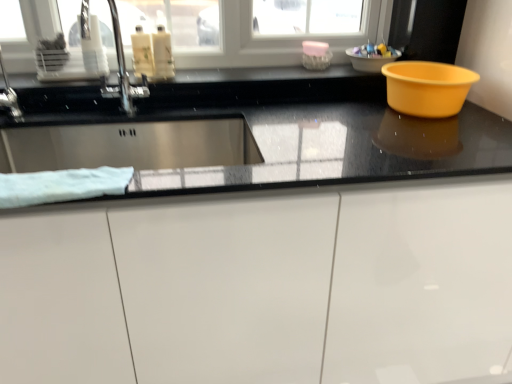
What do you see at coordinates (62, 185) in the screenshot?
I see `white soft towel at left` at bounding box center [62, 185].

The width and height of the screenshot is (512, 384). Describe the element at coordinates (426, 88) in the screenshot. I see `yellow plastic basin at right, the second basin when ordered from top to bottom` at that location.

From the picture: Measure the distance between translucent plastic bottles at upper center, the 2th liquid when ordered from right to left, and camera.

translucent plastic bottles at upper center, the 2th liquid when ordered from right to left, is 1.32 meters from camera.

How much space does translucent plastic bottles at upper center, which is the 1th liquid in right-to-left order, occupy horizontally?

translucent plastic bottles at upper center, which is the 1th liquid in right-to-left order, is 2.95 inches in width.

In the scene shown: Measure the distance between metallic faucet at upper left and camera.

Result: They are 1.27 meters apart.

What are the coordinates of `white glossy cabinet at lower center` in the screenshot? It's located at (264, 287).

From the image's perspective, which one is positioned lower, plastic bowl at upper right or translucent plastic bottles at upper center, which ranks as the 2th liquid in left-to-right order?

translucent plastic bottles at upper center, which ranks as the 2th liquid in left-to-right order, appears lower in the image.

Would you say plastic bowl at upper right is outside translucent plastic bottles at upper center, which ranks as the 2th liquid in left-to-right order?

Yes, plastic bowl at upper right is located beyond the bounds of translucent plastic bottles at upper center, which ranks as the 2th liquid in left-to-right order.

Is point (364, 47) closer or farther from the camera than point (164, 29)?

Clearly, point (364, 47) is more distant from the camera than point (164, 29).

Visually, is plastic bowl at upper right positioned to the left or to the right of translucent plastic bottles at upper center, which is the 1th liquid in right-to-left order?

Clearly, plastic bowl at upper right is on the right of translucent plastic bottles at upper center, which is the 1th liquid in right-to-left order, in the image.

Where is `food on the right of the white glossy cabinet at lower center`? food on the right of the white glossy cabinet at lower center is located at coordinates (373, 51).

Is white glossy cabinet at lower center at the back of plastic bowl at upper right?

No, plastic bowl at upper right is not facing the opposite direction of white glossy cabinet at lower center.

Is point (365, 50) positioned after point (434, 375)?

Yes, point (365, 50) is farther from viewer.

Does white glossy cabinet at lower center have a larger size compared to translucent plastic bottles at upper center, which appears as the 1th liquid when viewed from the left?

Indeed, white glossy cabinet at lower center has a larger size compared to translucent plastic bottles at upper center, which appears as the 1th liquid when viewed from the left.

Is translucent plastic bottles at upper center, which appears as the 1th liquid when viewed from the left, located within white glossy cabinet at lower center?

No.

In the scene shown: How many degrees apart are the facing directions of white glossy cabinet at lower center and translucent plastic bottles at upper center, the 2th liquid when ordered from right to left?

The angular difference between white glossy cabinet at lower center and translucent plastic bottles at upper center, the 2th liquid when ordered from right to left, is 0.895 degrees.

Locate an element on the screen. The width and height of the screenshot is (512, 384). the 1st liquid behind when counting from the white glossy cabinet at lower center is located at coordinates (142, 53).

Is white soft towel at left facing away from pink translucent soap at upper center?

No, white soft towel at left's orientation is not away from pink translucent soap at upper center.

Which object is closer to the camera taking this photo, white soft towel at left or pink translucent soap at upper center?

white soft towel at left.

Is white soft towel at left inside the boundaries of pink translucent soap at upper center, or outside?

white soft towel at left is not inside pink translucent soap at upper center, it's outside.

Would you say translucent plastic bottles at upper center, which appears as the 1th liquid when viewed from the left, is outside white soft towel at left?

That's correct, translucent plastic bottles at upper center, which appears as the 1th liquid when viewed from the left, is outside of white soft towel at left.

Considering the positions of objects translucent plastic bottles at upper center, which appears as the 1th liquid when viewed from the left, and white soft towel at left in the image provided, who is more to the left, translucent plastic bottles at upper center, which appears as the 1th liquid when viewed from the left, or white soft towel at left?

Positioned to the left is white soft towel at left.

Which is in front, point (325, 47) or point (141, 58)?

The point (141, 58) is closer to the camera.

Choose the correct answer: Is pink translucent soap at upper center inside translucent plastic bottles at upper center, the 2th liquid when ordered from right to left, or outside it?

pink translucent soap at upper center is spatially situated outside translucent plastic bottles at upper center, the 2th liquid when ordered from right to left.

Is pink translucent soap at upper center shorter than translucent plastic bottles at upper center, the 2th liquid when ordered from right to left?

Correct, pink translucent soap at upper center is not as tall as translucent plastic bottles at upper center, the 2th liquid when ordered from right to left.

Can you confirm if translucent plastic bottles at upper center, which ranks as the 2th liquid in left-to-right order, is bigger than translucent plastic bottles at upper center, the 2th liquid when ordered from right to left?

Actually, translucent plastic bottles at upper center, which ranks as the 2th liquid in left-to-right order, might be smaller than translucent plastic bottles at upper center, the 2th liquid when ordered from right to left.

Consider the image. From the image's perspective, is translucent plastic bottles at upper center, which ranks as the 2th liquid in left-to-right order, above or below translucent plastic bottles at upper center, which appears as the 1th liquid when viewed from the left?

translucent plastic bottles at upper center, which ranks as the 2th liquid in left-to-right order, is above translucent plastic bottles at upper center, which appears as the 1th liquid when viewed from the left.

Is translucent plastic bottles at upper center, which ranks as the 2th liquid in left-to-right order, to the left or to the right of translucent plastic bottles at upper center, which appears as the 1th liquid when viewed from the left, in the image?

translucent plastic bottles at upper center, which ranks as the 2th liquid in left-to-right order, is positioned on translucent plastic bottles at upper center, which appears as the 1th liquid when viewed from the left,'s right side.

Locate an element on the screen. The image size is (512, 384). food that appears above the translucent plastic bottles at upper center, which is the 1th liquid in right-to-left order (from the image's perspective) is located at coordinates (373, 51).

I want to click on cabinetry in front of the plastic bowl at upper right, so pyautogui.click(x=264, y=287).

When comparing their distances from metallic faucet at upper left, does plastic bowl at upper right or white soft towel at left seem further?

plastic bowl at upper right lies further to metallic faucet at upper left than the other object.

Looking at this image, when comparing their distances from yellow plastic basin at right, the second basin when ordered from top to bottom, does translucent plastic bottles at upper center, which appears as the 1th liquid when viewed from the left, or metallic faucet at upper left seem further?

metallic faucet at upper left is further to yellow plastic basin at right, the second basin when ordered from top to bottom.

When comparing their distances from yellow plastic basin at right, the 1th basin positioned from the bottom, does translucent plastic bottles at upper center, which ranks as the 2th liquid in left-to-right order, or metallic faucet at upper left seem further?

Based on the image, metallic faucet at upper left appears to be further to yellow plastic basin at right, the 1th basin positioned from the bottom.

When comparing their distances from matte plastic bowl at upper right, the 2th basin when ordered from bottom to top, does pink translucent soap at upper center or translucent plastic bottles at upper center, which is the 1th liquid in right-to-left order, seem further?

translucent plastic bottles at upper center, which is the 1th liquid in right-to-left order, lies further to matte plastic bowl at upper right, the 2th basin when ordered from bottom to top, than the other object.

Considering their positions, is yellow plastic basin at right, the second basin when ordered from top to bottom, positioned closer to white glossy cabinet at lower center than plastic bowl at upper right?

yellow plastic basin at right, the second basin when ordered from top to bottom, is closer to white glossy cabinet at lower center.

Based on their spatial positions, is white soft towel at left or translucent plastic bottles at upper center, which is the 1th liquid in right-to-left order, further from yellow plastic basin at right, the second basin when ordered from top to bottom?

white soft towel at left.

Based on their spatial positions, is white glossy cabinet at lower center or pink translucent soap at upper center closer to matte plastic bowl at upper right, the 1th basin when ordered from top to bottom?

pink translucent soap at upper center.

Estimate the real-world distances between objects in this image. Which object is closer to pink translucent soap at upper center, yellow plastic basin at right, the 1th basin positioned from the bottom, or white soft towel at left?

Based on the image, yellow plastic basin at right, the 1th basin positioned from the bottom, appears to be nearer to pink translucent soap at upper center.

Where is `liquid between translucent plastic bottles at upper center, which is the 1th liquid in right-to-left order, and white glossy cabinet at lower center, in the vertical direction`? The height and width of the screenshot is (384, 512). liquid between translucent plastic bottles at upper center, which is the 1th liquid in right-to-left order, and white glossy cabinet at lower center, in the vertical direction is located at coordinates (142, 53).

This screenshot has width=512, height=384. Identify the location of tap situated between white soft towel at left and plastic bowl at upper right from left to right. (122, 72).

Find the location of `basin positioned between yellow plastic basin at right, the second basin when ordered from top to bottom, and pink translucent soap at upper center from near to far`. basin positioned between yellow plastic basin at right, the second basin when ordered from top to bottom, and pink translucent soap at upper center from near to far is located at coordinates (370, 58).

At what (x,y) coordinates should I click in order to perform the action: click on cabinetry situated between metallic faucet at upper left and matte plastic bowl at upper right, the 2th basin when ordered from bottom to top, from left to right. Please return your answer as a coordinate pair (x, y). The height and width of the screenshot is (384, 512). Looking at the image, I should click on (264, 287).